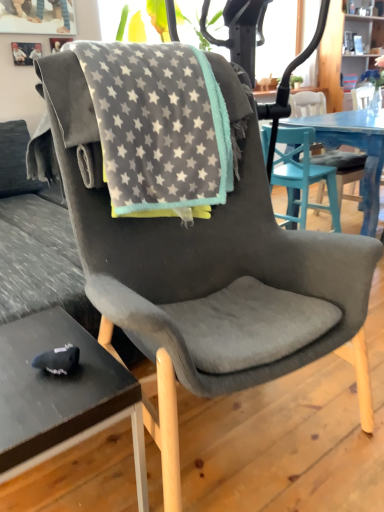
Where is `vacant point above black matte desk at lower left (from a real-world perspective)`? This screenshot has width=384, height=512. vacant point above black matte desk at lower left (from a real-world perspective) is located at coordinates (x=37, y=360).